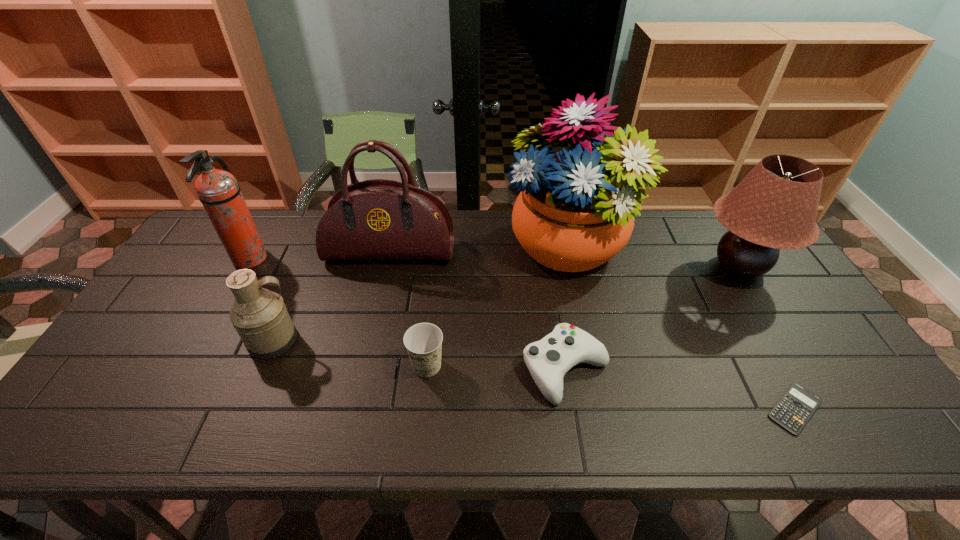
This screenshot has height=540, width=960. I want to click on flower arrangement, so click(x=575, y=210).

You are a GUI agent. You are given a task and a screenshot of the screen. Output one action in this format:
    pyautogui.click(x=<x>, y=<y>)
    Task: Click on the fire extinguisher
    Image resolution: width=960 pixels, height=540 pixels.
    Given the screenshot: What is the action you would take?
    click(x=218, y=191)

Identify the location of handbag. This screenshot has width=960, height=540. (377, 219).

At what (x,y) coordinates should I click in order to perform the action: click on lampshade. Please return your answer as a coordinate pair (x, y). This screenshot has width=960, height=540. Looking at the image, I should click on (774, 207).

Where is `pitcher`? The height and width of the screenshot is (540, 960). pitcher is located at coordinates (260, 317).

Find the location of a particular element. the sixth tallest object is located at coordinates (423, 341).

This screenshot has width=960, height=540. Find the location of `the seventh tallest object`. the seventh tallest object is located at coordinates (548, 360).

The height and width of the screenshot is (540, 960). I want to click on calculator, so click(x=794, y=409).

This screenshot has width=960, height=540. Identify the location of vacant space situated 0.210m on the right of the tallest object. (691, 245).

Identify the location of vacant region located 0.120m at the nozzle of the fire extinguisher. (304, 259).